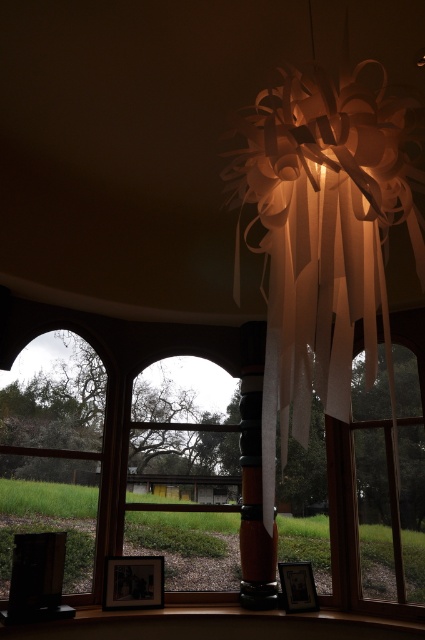
You are standing in the room and want to look outside through the clear glass window at left. Where should you move to in the room to do so?

You should move to the left side of the room near the clear glass window at left, which is located at point 0.705 on the x axis and 0.122 on the y axis.

You are standing in the room and looking at two points marked in the image. The first point is at coordinates point (5, 468) and the second is at point (288, 595). Which point is closer to you?

Point (5, 468) is closer to you because it is further to the viewer than point (288, 595).